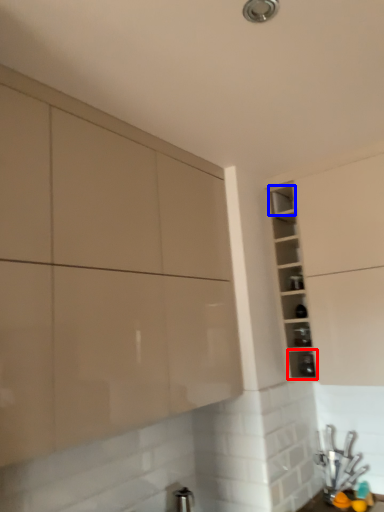
Question: Among these objects, which one is nearest to the camera, shelf (highlighted by a red box) or shelf (highlighted by a blue box)?

Choices:
 (A) shelf
 (B) shelf

Answer: (A)